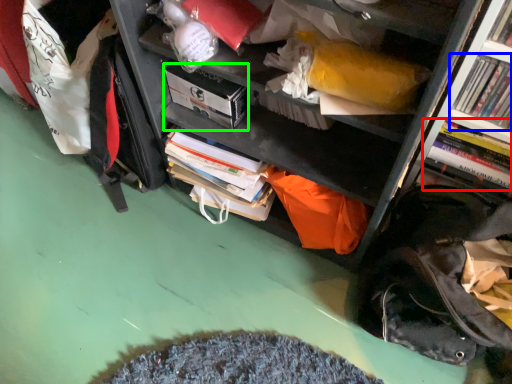
Question: Considering the real-world distances, which object is closest to book (highlighted by a red box)? book (highlighted by a blue box) or paperback book (highlighted by a green box).

Choices:
 (A) book
 (B) paperback book

Answer: (A)